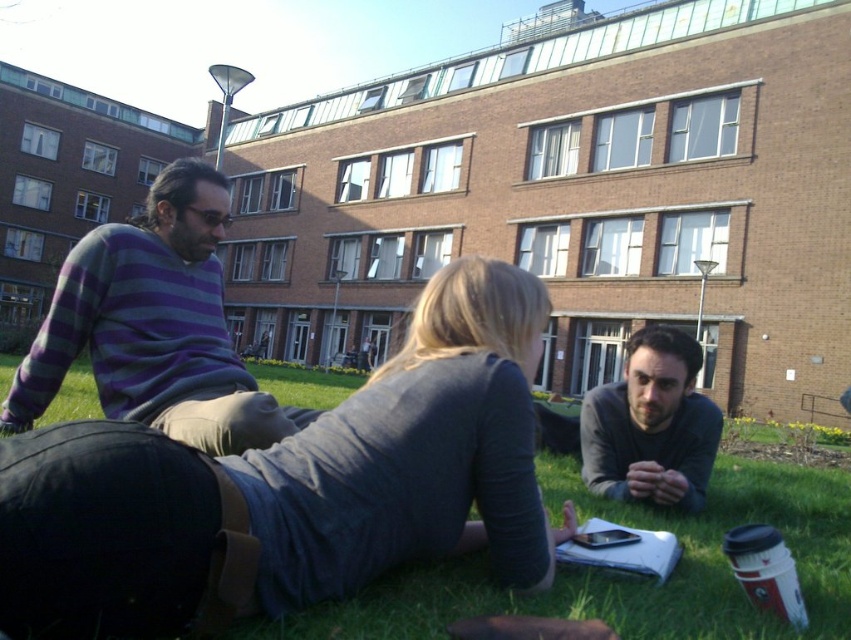
Question: Based on their relative distances, which object is nearer to the smooth gray shirt at center?

Choices:
 (A) dark gray sweater at center
 (B) striped sweater at left

Answer: (A)

Question: Among these points, which one is farthest from the camera?

Choices:
 (A) (690, 472)
 (B) (103, 320)

Answer: (A)

Question: Observing the image, what is the correct spatial positioning of striped sweater at left in reference to smooth gray shirt at center?

Choices:
 (A) below
 (B) above

Answer: (B)

Question: Which object appears farthest from the camera in this image?

Choices:
 (A) striped sweater at left
 (B) smooth gray shirt at center

Answer: (B)

Question: Is dark gray sweater at center closer to camera compared to smooth gray shirt at center?

Choices:
 (A) yes
 (B) no

Answer: (A)

Question: Is striped sweater at left thinner than smooth gray shirt at center?

Choices:
 (A) yes
 (B) no

Answer: (B)